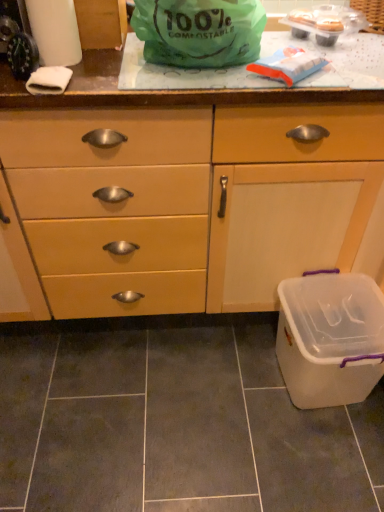
Question: Is white paper towel at upper left facing away from white plastic container at lower right?

Choices:
 (A) no
 (B) yes

Answer: (A)

Question: Considering the relative sizes of white paper towel at upper left and white plastic container at lower right in the image provided, is white paper towel at upper left wider than white plastic container at lower right?

Choices:
 (A) yes
 (B) no

Answer: (B)

Question: Does white paper towel at upper left have a smaller size compared to white plastic container at lower right?

Choices:
 (A) no
 (B) yes

Answer: (B)

Question: Can you confirm if white paper towel at upper left is taller than white plastic container at lower right?

Choices:
 (A) yes
 (B) no

Answer: (B)

Question: Is white paper towel at upper left further to the viewer compared to white plastic container at lower right?

Choices:
 (A) no
 (B) yes

Answer: (A)

Question: Relative to matte wood cabinet at center, is white plastic container at lower right in front or behind?

Choices:
 (A) front
 (B) behind

Answer: (B)

Question: Would you say white plastic container at lower right is inside or outside matte wood cabinet at center?

Choices:
 (A) outside
 (B) inside

Answer: (A)

Question: In terms of size, does white plastic container at lower right appear bigger or smaller than matte wood cabinet at center?

Choices:
 (A) small
 (B) big

Answer: (A)

Question: In terms of height, does white plastic container at lower right look taller or shorter compared to matte wood cabinet at center?

Choices:
 (A) short
 (B) tall

Answer: (A)

Question: Is matte wood cabinet at center taller or shorter than white plastic container at lower right?

Choices:
 (A) tall
 (B) short

Answer: (A)

Question: Do you think matte wood cabinet at center is within white plastic container at lower right, or outside of it?

Choices:
 (A) outside
 (B) inside

Answer: (A)

Question: Looking at the image, does matte wood cabinet at center seem bigger or smaller compared to white plastic container at lower right?

Choices:
 (A) big
 (B) small

Answer: (A)

Question: Looking at their shapes, would you say matte wood cabinet at center is wider or thinner than white plastic container at lower right?

Choices:
 (A) wide
 (B) thin

Answer: (A)

Question: Considering their positions, is green compostable bag at upper center located in front of or behind matte wood cabinet at center?

Choices:
 (A) front
 (B) behind

Answer: (A)

Question: Based on their sizes in the image, would you say green compostable bag at upper center is bigger or smaller than matte wood cabinet at center?

Choices:
 (A) big
 (B) small

Answer: (B)